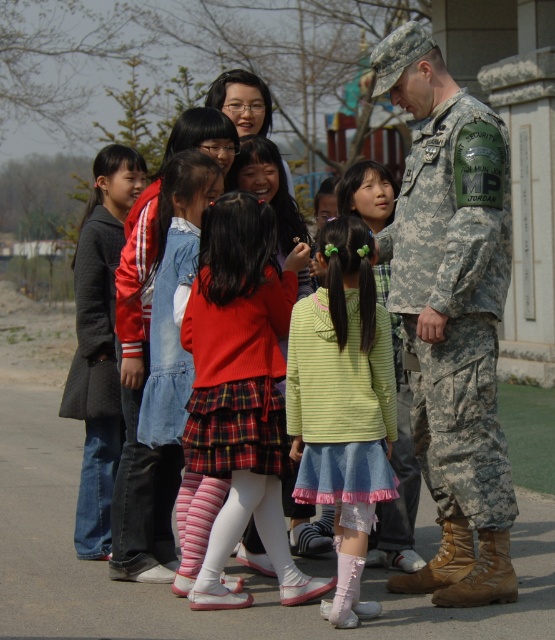
From the picture: You are a tailor trying to decide which garment to alter first. You have the light green denim skirt at center and the dark gray wool coat at left. Which garment has a larger width and requires more fabric for alterations?

The light green denim skirt at center has a larger width than the dark gray wool coat at left, so it requires more fabric for alterations.

What is the location of the point with coordinates (x=452, y=314) in the image?

The point with coordinates (x=452, y=314) is located on the camouflage uniform at right.

You are a tailor who needs to determine which clothing item requires more fabric to make between the camouflage uniform at right and the dark gray wool coat at left. Which one would need more fabric?

The camouflage uniform at right is larger in size than the dark gray wool coat at left, so it would require more fabric to make.